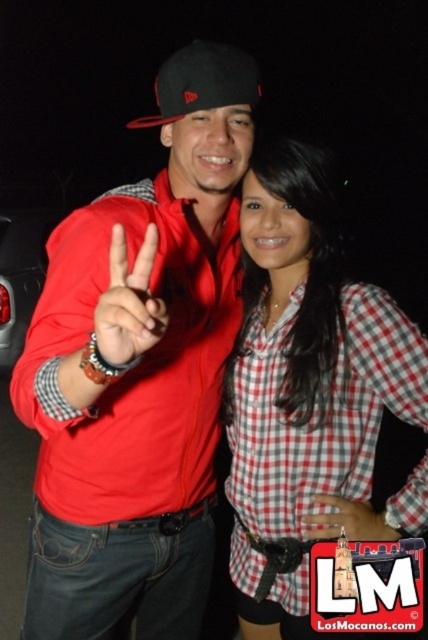
You are a photographer trying to capture a closeup shot of both the matte red jacket at center and the black matte baseball cap at center. Your camera can focus on objects within a 20 inch range. Can you fit both items in the focus range?

The matte red jacket at center is 25.70 inches away from the black matte baseball cap at center. Since the distance between them exceeds the camera focus range of 20 inches, you cannot fit both items in the focus range.

You are a photographer trying to capture a clear shot of both the checkered fabric shirt at center and the black matte baseball cap at center. Based on their positions, which one might be partially obscured in the photo?

The black matte baseball cap at center might be partially obscured because the checkered fabric shirt at center is in front of it.